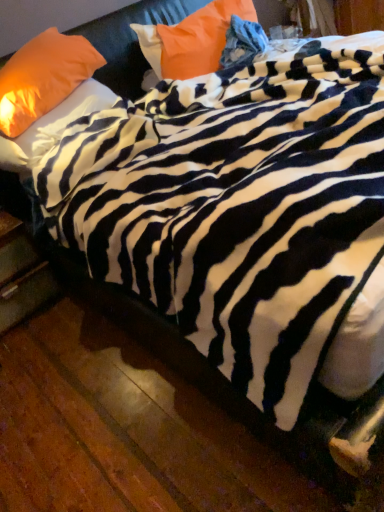
Question: Is orange fabric pillow at upper center, marked as the third pillow in a left-to-right arrangement, turned away from matte orange pillow at upper left, marked as the second pillow in a left-to-right arrangement?

Choices:
 (A) yes
 (B) no

Answer: (B)

Question: Does orange fabric pillow at upper center, positioned as the first pillow in right-to-left order, lie behind matte orange pillow at upper left, marked as the second pillow in a left-to-right arrangement?

Choices:
 (A) yes
 (B) no

Answer: (A)

Question: Considering the relative positions of orange fabric pillow at upper center, marked as the third pillow in a left-to-right arrangement, and matte orange pillow at upper left, marked as the second pillow in a left-to-right arrangement, in the image provided, is orange fabric pillow at upper center, marked as the third pillow in a left-to-right arrangement, to the right of matte orange pillow at upper left, marked as the second pillow in a left-to-right arrangement, from the viewer's perspective?

Choices:
 (A) yes
 (B) no

Answer: (A)

Question: Does orange fabric pillow at upper center, positioned as the first pillow in right-to-left order, have a larger size compared to matte orange pillow at upper left, marked as the second pillow in a left-to-right arrangement?

Choices:
 (A) yes
 (B) no

Answer: (B)

Question: Is orange fabric pillow at upper center, positioned as the first pillow in right-to-left order, thinner than matte orange pillow at upper left, marked as the second pillow in a left-to-right arrangement?

Choices:
 (A) yes
 (B) no

Answer: (A)

Question: Is orange fabric pillow at upper center, marked as the third pillow in a left-to-right arrangement, aimed at matte orange pillow at upper left, marked as the second pillow in a left-to-right arrangement?

Choices:
 (A) yes
 (B) no

Answer: (B)

Question: Does wooden drawer at lower left have a smaller size compared to orange fabric pillow at upper center, positioned as the first pillow in right-to-left order?

Choices:
 (A) yes
 (B) no

Answer: (B)

Question: Is there a large distance between wooden drawer at lower left and orange fabric pillow at upper center, positioned as the first pillow in right-to-left order?

Choices:
 (A) yes
 (B) no

Answer: (A)

Question: Considering the relative sizes of wooden drawer at lower left and orange fabric pillow at upper center, marked as the third pillow in a left-to-right arrangement, in the image provided, is wooden drawer at lower left shorter than orange fabric pillow at upper center, marked as the third pillow in a left-to-right arrangement,?

Choices:
 (A) no
 (B) yes

Answer: (A)

Question: From the image's perspective, does wooden drawer at lower left appear lower than orange fabric pillow at upper center, marked as the third pillow in a left-to-right arrangement?

Choices:
 (A) yes
 (B) no

Answer: (A)

Question: Is wooden drawer at lower left positioned in front of orange fabric pillow at upper center, marked as the third pillow in a left-to-right arrangement?

Choices:
 (A) yes
 (B) no

Answer: (A)

Question: From the image's perspective, is wooden drawer at lower left over orange fabric pillow at upper center, marked as the third pillow in a left-to-right arrangement?

Choices:
 (A) no
 (B) yes

Answer: (A)

Question: Is orange fabric pillow at upper left, the 1th pillow viewed from the left, aimed at matte orange pillow at upper left, marked as the second pillow in a left-to-right arrangement?

Choices:
 (A) no
 (B) yes

Answer: (A)